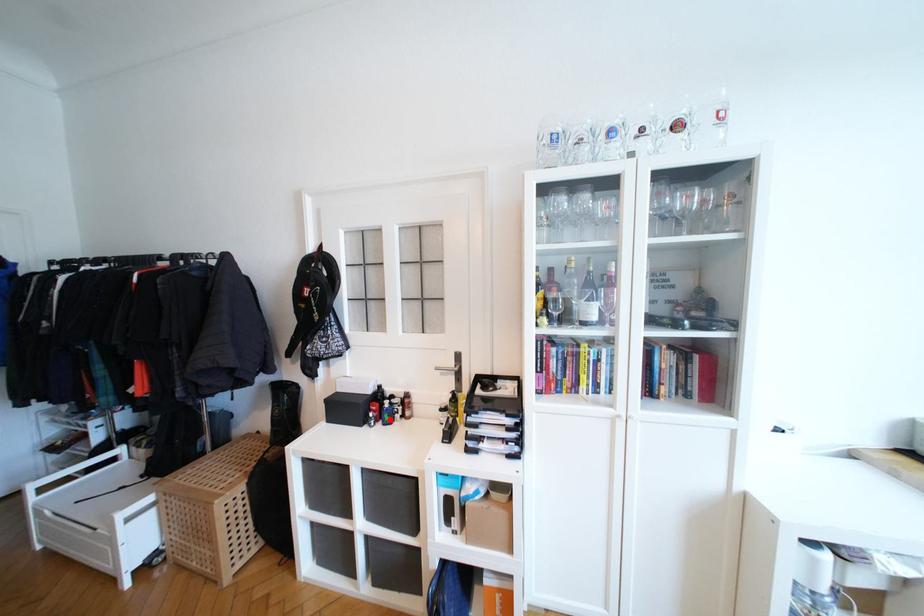
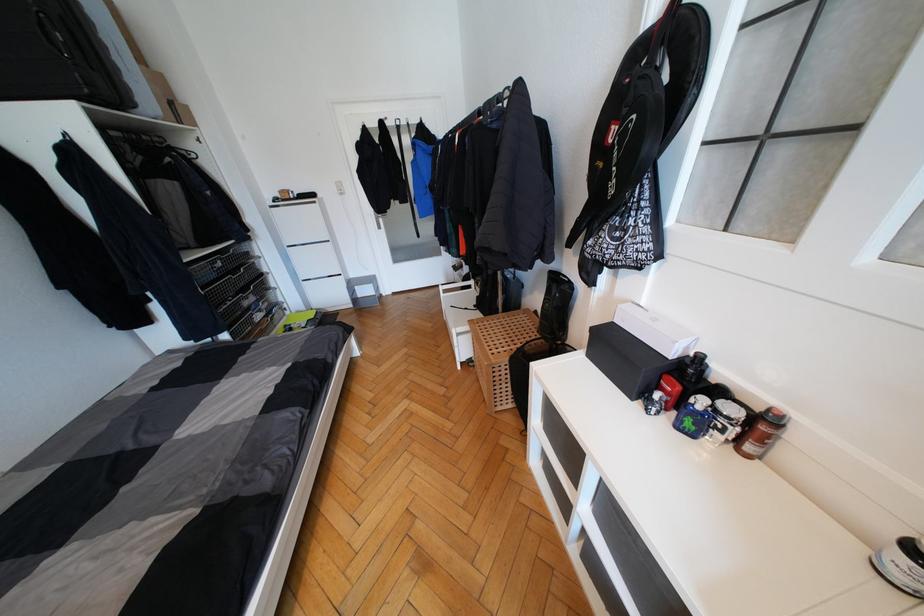
Question: I am providing you with two images of the same scene from different viewpoints. A red point is shown in image1. For the corresponding object point in image2, is it positioned nearer or farther from the camera?

Choices:
 (A) Nearer
 (B) Farther

Answer: (A)